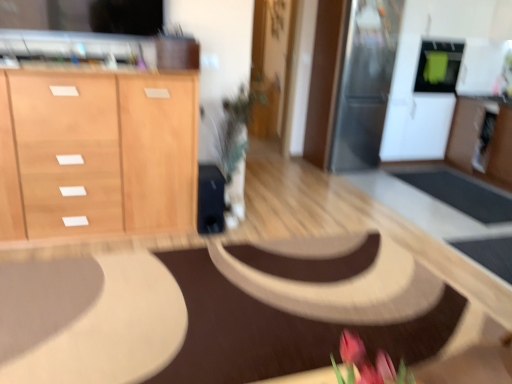
This screenshot has width=512, height=384. In order to click on vacant space underneath brown fabric mat at center (from a real-world perspective) in this screenshot , I will do `click(224, 298)`.